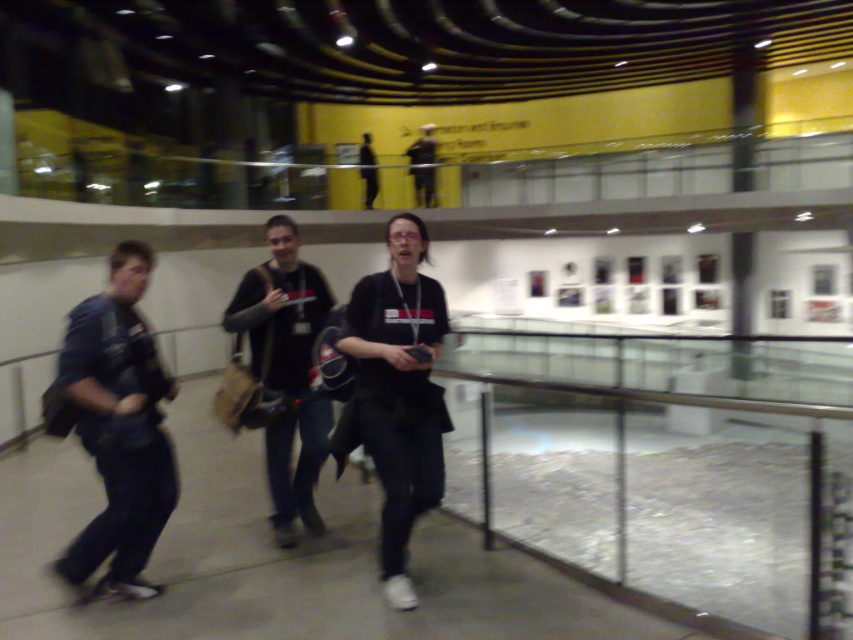
You are an event planner trying to arrange seating for a small group in this space. You need to seat two people who will be sitting side by side. The chairs available are only 1 meter apart. Considering the clothing of the dark blue fabric jacket at left and the black matte shirt at center, which person requires more space between them to accommodate their clothing?

The dark blue fabric jacket at left requires more space between them because its width is larger than the black matte shirt at center, so the chairs should be spaced wider to accommodate the jacket.